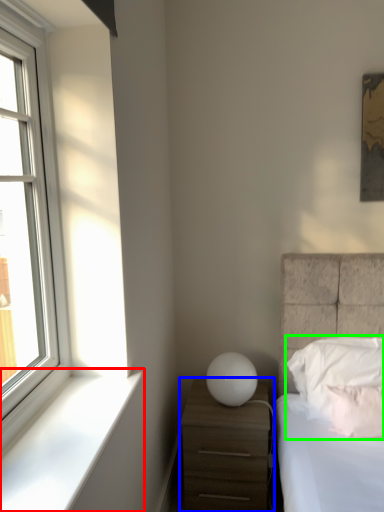
Question: Which object is the closest to the window sill (highlighted by a red box)? Choose among these: nightstand (highlighted by a blue box) or pillow (highlighted by a green box).

Choices:
 (A) nightstand
 (B) pillow

Answer: (A)